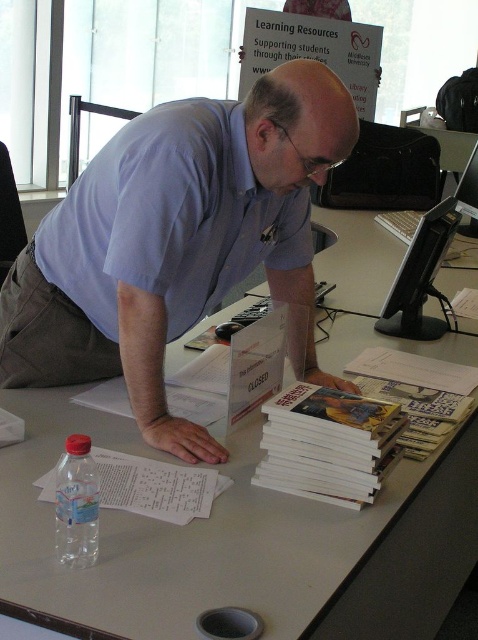
Is white matte table at center taller than black plastic monitor at upper right?

Indeed, white matte table at center has a greater height compared to black plastic monitor at upper right.

Based on the photo, who is more forward, (76, 417) or (402, 300)?

Point (76, 417) is more forward.

This screenshot has width=478, height=640. Find the location of `white matte table at center`. white matte table at center is located at coordinates (240, 544).

Who is taller, blue cotton shirt at center or black plastic monitor at upper right?

Standing taller between the two is blue cotton shirt at center.

Which is in front, point (160, 308) or point (435, 252)?

Point (160, 308)

Between point (175, 170) and point (380, 314), which one is positioned behind?

Positioned behind is point (380, 314).

Locate an element on the screen. This screenshot has width=478, height=640. blue cotton shirt at center is located at coordinates (173, 240).

Is white paper at lower left to the right of translucent plastic bottle at lower left from the viewer's perspective?

Yes, white paper at lower left is to the right of translucent plastic bottle at lower left.

What do you see at coordinates (156, 486) in the screenshot? This screenshot has height=640, width=478. I see `white paper at lower left` at bounding box center [156, 486].

Where is `white paper at lower left`? white paper at lower left is located at coordinates (156, 486).